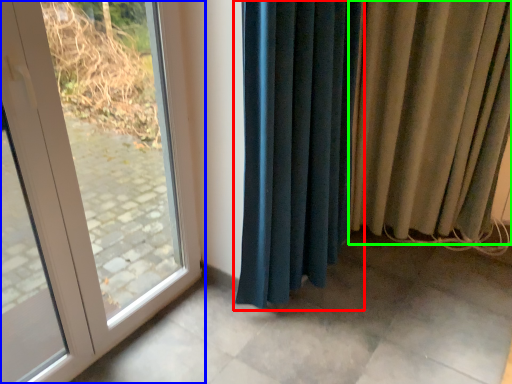
Question: Which is farther away from curtain (highlighted by a red box)? door (highlighted by a blue box) or curtain (highlighted by a green box)?

Choices:
 (A) door
 (B) curtain

Answer: (A)